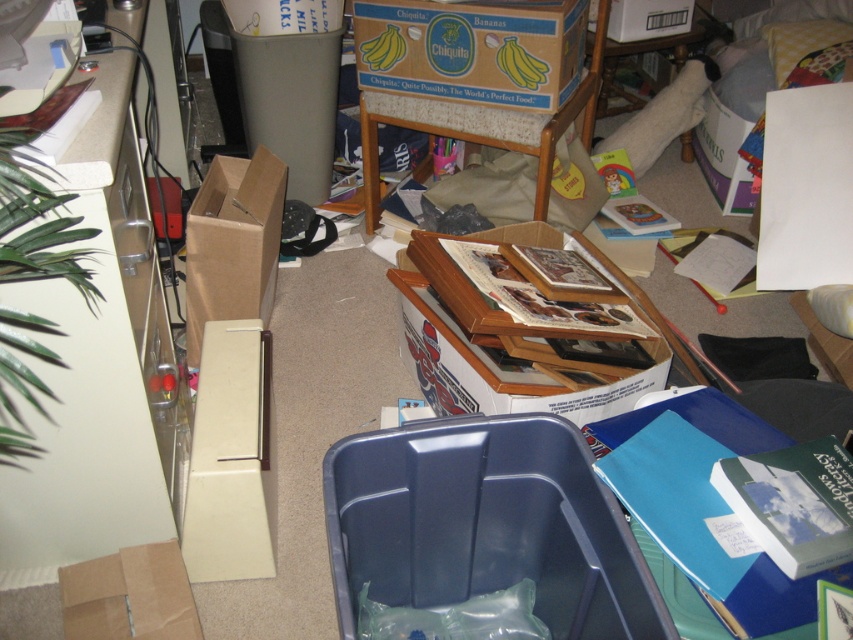
Question: From the image, what is the correct spatial relationship of blue plastic recycling bin at lower center in relation to white cardboard box at upper center?

Choices:
 (A) above
 (B) below

Answer: (B)

Question: Which point is farther to the camera?

Choices:
 (A) (347, 500)
 (B) (666, 29)

Answer: (B)

Question: Which point is farther to the camera?

Choices:
 (A) (202, 502)
 (B) (485, 60)

Answer: (B)

Question: Estimate the real-world distances between objects in this image. Which object is farther from the blue plastic recycling bin at lower center?

Choices:
 (A) matte cardboard box at upper center
 (B) cardboard box at left
 (C) white cardboard box at center

Answer: (A)

Question: Does matte cardboard box at upper center have a larger size compared to white cardboard box at upper center?

Choices:
 (A) yes
 (B) no

Answer: (A)

Question: Does matte cardboard box at upper center lie in front of white cardboard box at center?

Choices:
 (A) no
 (B) yes

Answer: (A)